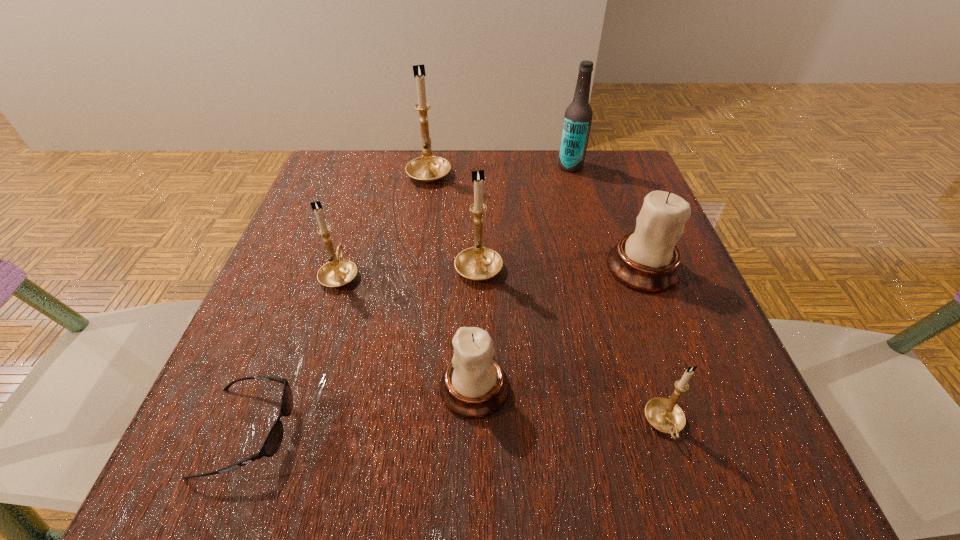
The image size is (960, 540). I want to click on vacant region at the left edge, so click(x=288, y=305).

Locate an element on the screen. This screenshot has height=540, width=960. vacant space at the right edge of the desktop is located at coordinates (739, 417).

The height and width of the screenshot is (540, 960). In order to click on vacant space at the far left corner of the desktop in this screenshot , I will do `click(339, 181)`.

This screenshot has height=540, width=960. Identify the location of free space at the far right corner. (621, 186).

At what (x,y) coordinates should I click in order to perform the action: click on vacant region at the near right corner. Please return your answer as a coordinate pair (x, y). The height and width of the screenshot is (540, 960). Looking at the image, I should click on (704, 462).

Locate an element on the screen. free space between the gray sunglasses and the smaller white candle holder is located at coordinates (361, 410).

Locate an element on the screen. vacant area between the second gold candle holder from right to left and the rightmost gold candle holder is located at coordinates (571, 344).

At what (x,y) coordinates should I click in order to perform the action: click on free space between the gray sunglasses and the third tallest object. Please return your answer as a coordinate pair (x, y). Looking at the image, I should click on (363, 348).

Locate an element on the screen. unoccupied area between the biggest gold candle holder and the beer bottle is located at coordinates (500, 169).

Where is `vacant area that lies between the sunglasses and the right white candle holder`? This screenshot has height=540, width=960. vacant area that lies between the sunglasses and the right white candle holder is located at coordinates (445, 349).